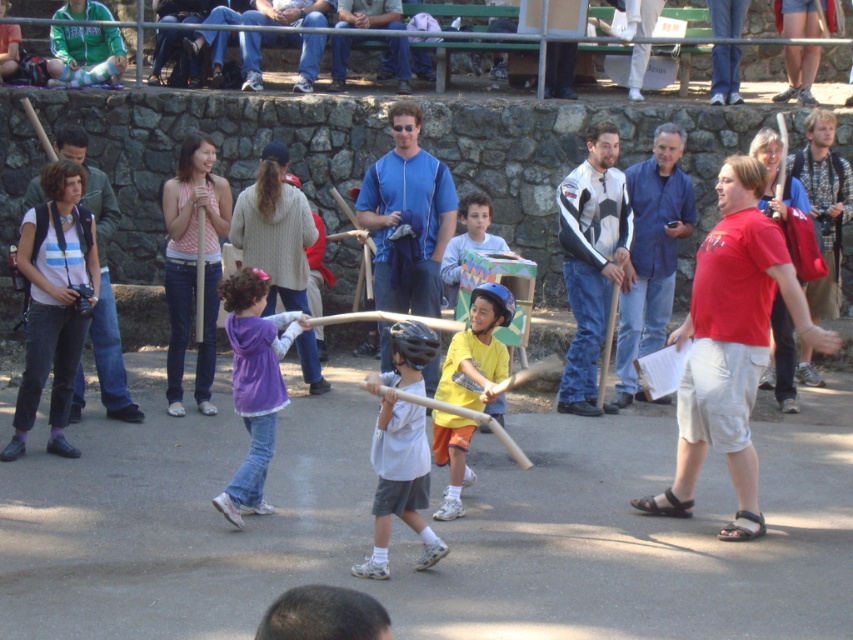
Who is shorter, purple fleece jacket at center or denim jeans at upper center?

With less height is denim jeans at upper center.

Between purple fleece jacket at center and denim jeans at upper center, which one is positioned higher?

denim jeans at upper center is above.

Find the location of `purple fleece jacket at center`. purple fleece jacket at center is located at coordinates (254, 384).

This screenshot has height=640, width=853. Find the location of `purple fleece jacket at center`. purple fleece jacket at center is located at coordinates (254, 384).

Which is more to the left, white matte baseball bat at center or green fleece jacket at upper left?

green fleece jacket at upper left

Between white matte baseball bat at center and green fleece jacket at upper left, which one has more height?

With more height is white matte baseball bat at center.

You are a GUI agent. You are given a task and a screenshot of the screen. Output one action in this format:
    pyautogui.click(x=<x>, y=<y>)
    Task: Click on the white matte baseball bat at center
    This screenshot has height=640, width=853.
    Given the screenshot: What is the action you would take?
    pos(401,451)

Find the location of a particular element. white matte baseball bat at center is located at coordinates (401, 451).

Who is positioned more to the right, white and black leather jacket at center or denim jeans at upper center?

Positioned to the right is white and black leather jacket at center.

Between point (566, 282) and point (296, 22), which one is positioned behind?

Point (296, 22)

Between point (579, 170) and point (260, 36), which one is positioned behind?

Positioned behind is point (260, 36).

I want to click on white and black leather jacket at center, so click(x=590, y=259).